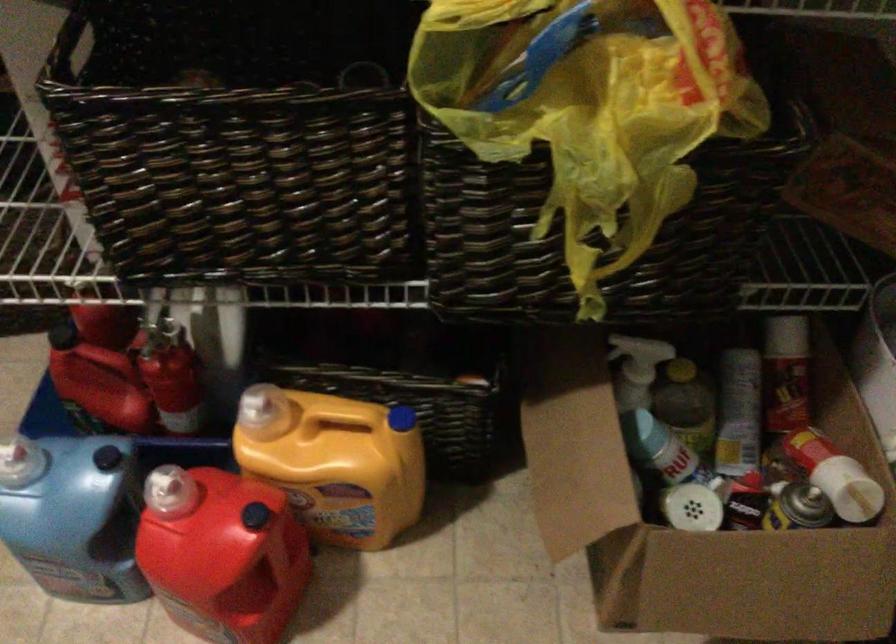
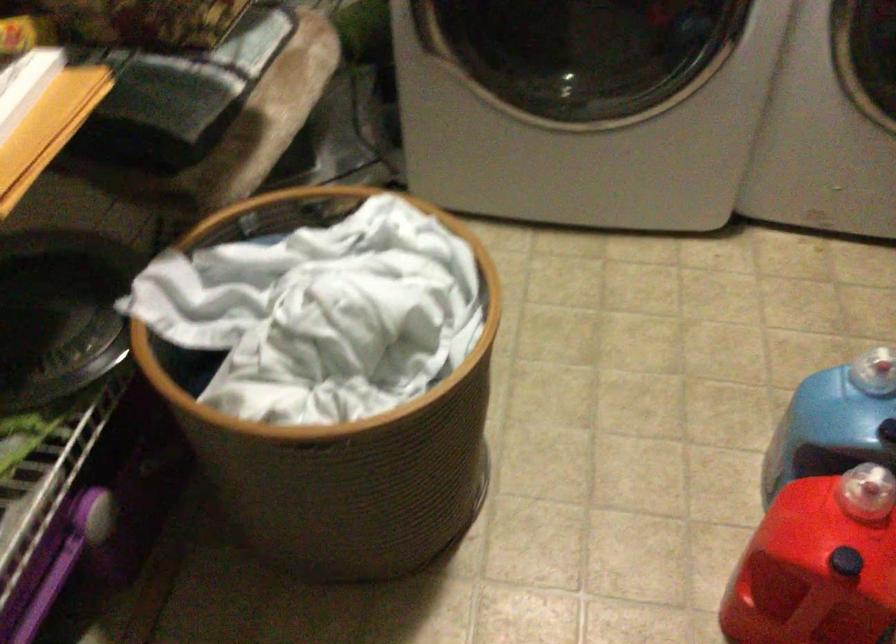
First-person continuous shooting, in which direction is the camera rotating?

The camera's rotation is toward left-down.